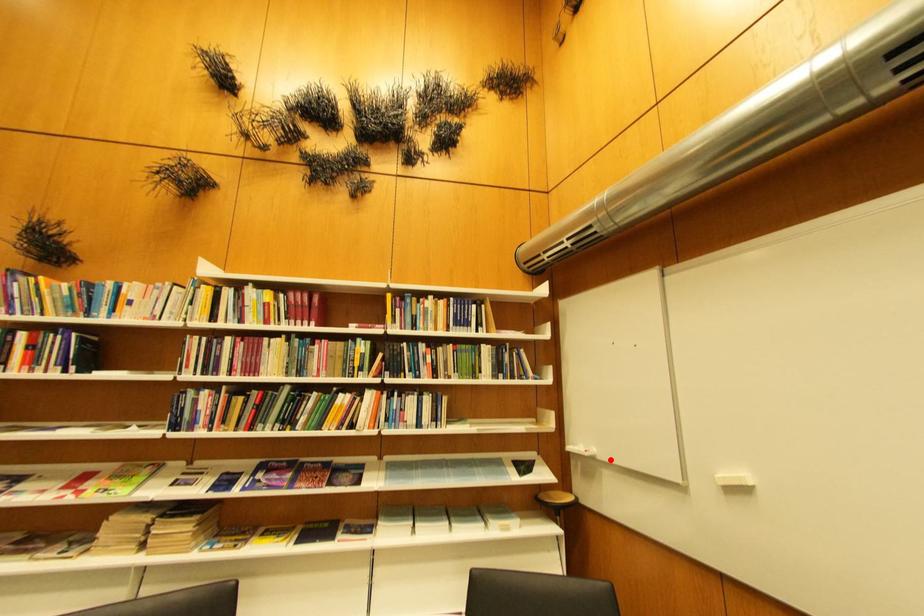
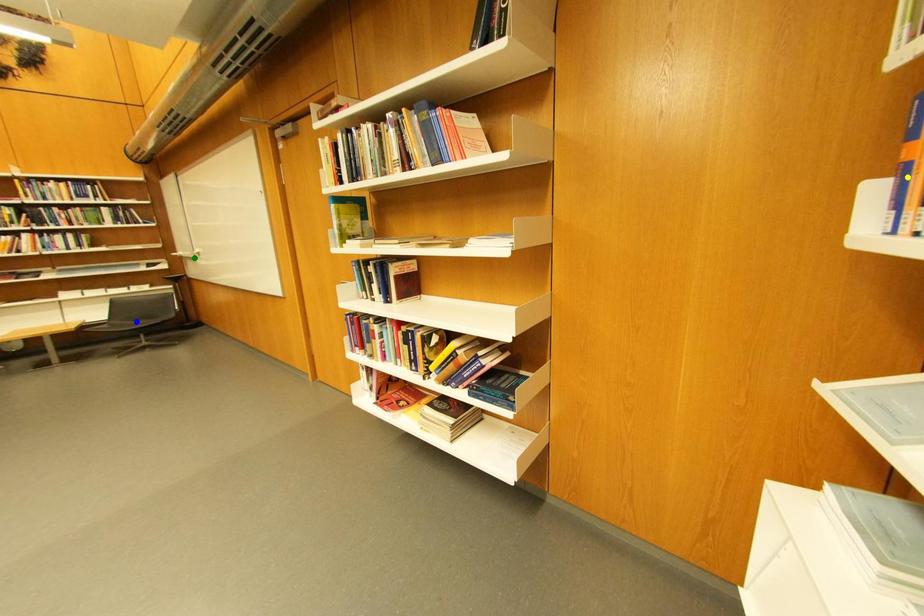
Question: I am providing you with two images of the same scene from different viewpoints. A red point is marked on the first image. You are given multiple points on the second image. Which spot in image 2 lines up with the point in image 1?

Choices:
 (A) yellow point
 (B) blue point
 (C) green point

Answer: (C)